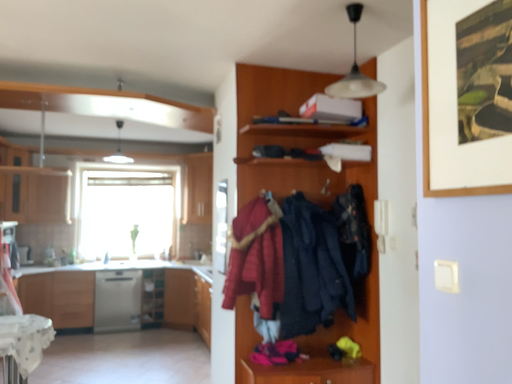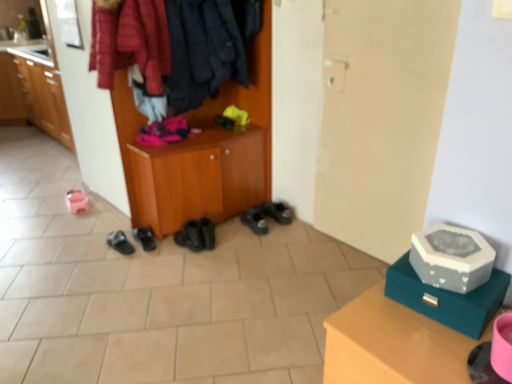
Question: How did the camera likely rotate when shooting the video?

Choices:
 (A) rotated right
 (B) rotated left

Answer: (A)